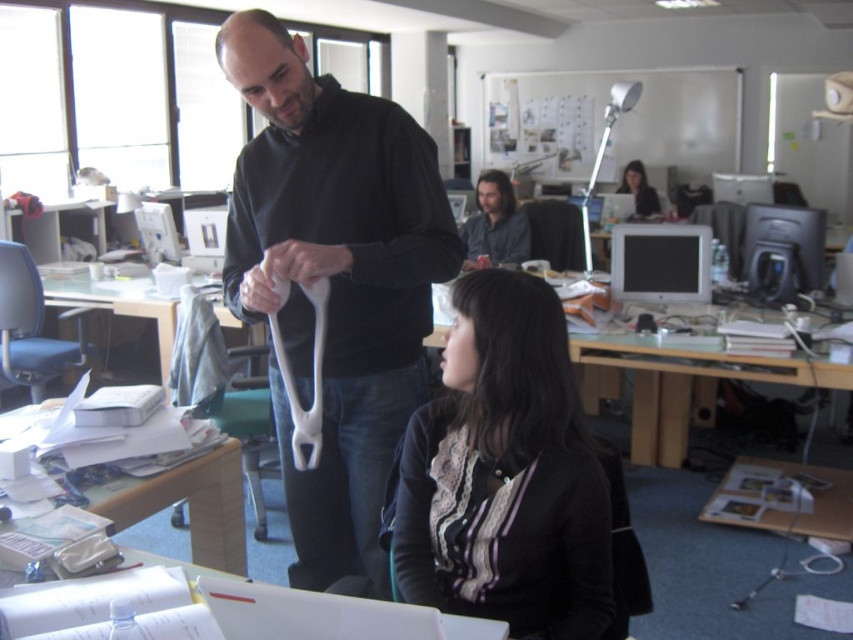
Question: Is white matte wii remote at center further to camera compared to dark gray sweater at center?

Choices:
 (A) no
 (B) yes

Answer: (A)

Question: Which object is the closest to the black matte sweater at center?

Choices:
 (A) dark gray sweater at center
 (B) white matte wii remote at center
 (C) matte black sweater at center

Answer: (B)

Question: Does black matte sweater at center have a greater width compared to matte black sweater at center?

Choices:
 (A) no
 (B) yes

Answer: (B)

Question: Which object appears farthest from the camera in this image?

Choices:
 (A) white matte wii remote at center
 (B) black matte sweater at center
 (C) matte black hair at upper center

Answer: (C)

Question: Which of the following is the farthest from the observer?

Choices:
 (A) dark gray sweater at center
 (B) white matte wii remote at center
 (C) matte black hair at upper center
 (D) black matte sweater at center

Answer: (C)

Question: Can you confirm if black matte sweater at center is bigger than dark gray sweater at center?

Choices:
 (A) yes
 (B) no

Answer: (A)